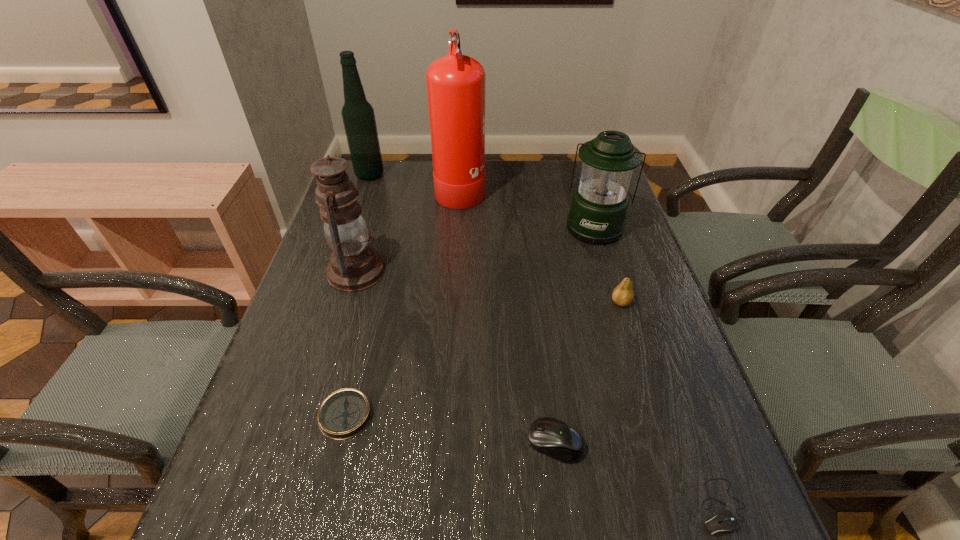
Find the location of `alcohol that is positioned at the far edge`. alcohol that is positioned at the far edge is located at coordinates (358, 116).

Identify the location of object that is at the near edge. (725, 521).

Locate an element on the screen. This screenshot has height=540, width=960. alcohol present at the left edge is located at coordinates (358, 116).

Identify the location of oil lamp at the left edge. This screenshot has height=540, width=960. (354, 266).

Locate an element on the screen. The image size is (960, 540). compass that is at the left edge is located at coordinates (345, 413).

Where is `lantern located at the right edge`? lantern located at the right edge is located at coordinates (599, 205).

Find the location of a particular element. pear situated at the right edge is located at coordinates (623, 294).

Where is `computer mouse located in the right edge section of the desktop`? computer mouse located in the right edge section of the desktop is located at coordinates (725, 521).

At what (x,y) coordinates should I click in order to perform the action: click on object present at the far left corner. Please return your answer as a coordinate pair (x, y). This screenshot has height=540, width=960. Looking at the image, I should click on (358, 116).

At what (x,y) coordinates should I click in order to perform the action: click on object located at the near right corner. Please return your answer as a coordinate pair (x, y). The image size is (960, 540). Looking at the image, I should click on (725, 521).